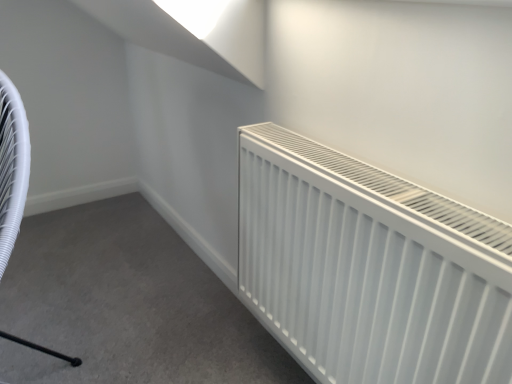
What do you see at coordinates (369, 268) in the screenshot? I see `white matte radiator at right` at bounding box center [369, 268].

Identify the location of white matte radiator at right. (369, 268).

What do you see at coordinates (12, 166) in the screenshot? This screenshot has width=512, height=384. I see `white plastic swivel chair at left` at bounding box center [12, 166].

Where is `white plastic swivel chair at left`? Image resolution: width=512 pixels, height=384 pixels. white plastic swivel chair at left is located at coordinates (12, 166).

What are the coordinates of `white matte radiator at right` in the screenshot? It's located at (369, 268).

Is white plastic swivel chair at left at the left side of white matte radiator at right?

Indeed, white plastic swivel chair at left is positioned on the left side of white matte radiator at right.

Is white plastic swivel chair at left in front of or behind white matte radiator at right in the image?

white plastic swivel chair at left is in front of white matte radiator at right.

Considering the positions of point (75, 363) and point (330, 365), is point (75, 363) closer or farther from the camera than point (330, 365)?

Point (75, 363) is positioned farther from the camera compared to point (330, 365).

From the image's perspective, is white plastic swivel chair at left under white matte radiator at right?

Actually, white plastic swivel chair at left appears above white matte radiator at right in the image.

From a real-world perspective, does white plastic swivel chair at left stand above white matte radiator at right?

Yes.

In terms of width, does white plastic swivel chair at left look wider or thinner when compared to white matte radiator at right?

In the image, white plastic swivel chair at left appears to be wider than white matte radiator at right.

Can you confirm if white plastic swivel chair at left is shorter than white matte radiator at right?

No.

Considering the relative sizes of white plastic swivel chair at left and white matte radiator at right in the image provided, is white plastic swivel chair at left smaller than white matte radiator at right?

No, white plastic swivel chair at left is not smaller than white matte radiator at right.

Would you say white plastic swivel chair at left is inside or outside white matte radiator at right?

white plastic swivel chair at left is not inside white matte radiator at right, it's outside.

Is white plastic swivel chair at left not close to white matte radiator at right?

No, white plastic swivel chair at left is not far from white matte radiator at right.

Is white plastic swivel chair at left looking in the opposite direction of white matte radiator at right?

white plastic swivel chair at left is not turned away from white matte radiator at right.

Where is `swivel chair positioned vertically above the white matte radiator at right (from a real-world perspective)`? The height and width of the screenshot is (384, 512). swivel chair positioned vertically above the white matte radiator at right (from a real-world perspective) is located at coordinates (12, 166).

Would you say white matte radiator at right is to the left or to the right of white plastic swivel chair at left in the picture?

Clearly, white matte radiator at right is on the right of white plastic swivel chair at left in the image.

Between white matte radiator at right and white plastic swivel chair at left, which one is positioned behind?

white matte radiator at right.

Is point (274, 135) farther from camera compared to point (16, 149)?

Yes, point (274, 135) is farther from viewer.

From the image's perspective, which one is positioned higher, white matte radiator at right or white plastic swivel chair at left?

From the image's view, white plastic swivel chair at left is above.

From a real-world perspective, is white matte radiator at right located beneath white plastic swivel chair at left?

Indeed, from a real-world perspective, white matte radiator at right is positioned beneath white plastic swivel chair at left.

Which of these two, white matte radiator at right or white plastic swivel chair at left, is wider?

With larger width is white plastic swivel chair at left.

Can you confirm if white matte radiator at right is taller than white plastic swivel chair at left?

In fact, white matte radiator at right may be shorter than white plastic swivel chair at left.

Considering the sizes of objects white matte radiator at right and white plastic swivel chair at left in the image provided, who is bigger, white matte radiator at right or white plastic swivel chair at left?

white plastic swivel chair at left.

Is white matte radiator at right inside the boundaries of white plastic swivel chair at left, or outside?

The correct answer is: outside.

Is white matte radiator at right touching white plastic swivel chair at left?

white matte radiator at right and white plastic swivel chair at left are clearly separated.

Is white matte radiator at right facing away from white plastic swivel chair at left?

No.

At what (x,y) coordinates should I click in order to perform the action: click on radiator on the right of white plastic swivel chair at left. Please return your answer as a coordinate pair (x, y). This screenshot has height=384, width=512. Looking at the image, I should click on pos(369,268).

This screenshot has height=384, width=512. Identify the location of swivel chair on the left of the white matte radiator at right. (12, 166).

I want to click on swivel chair that is in front of the white matte radiator at right, so click(x=12, y=166).